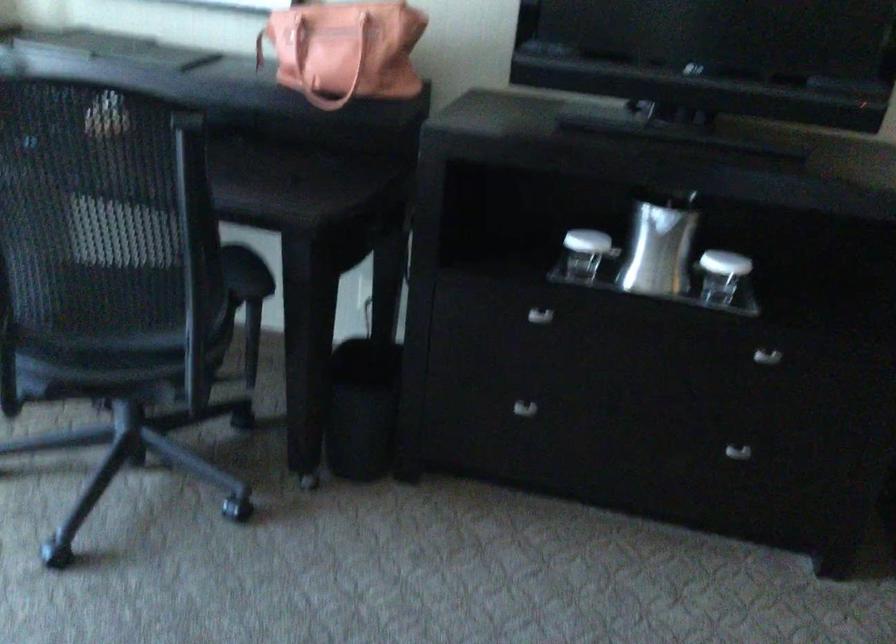
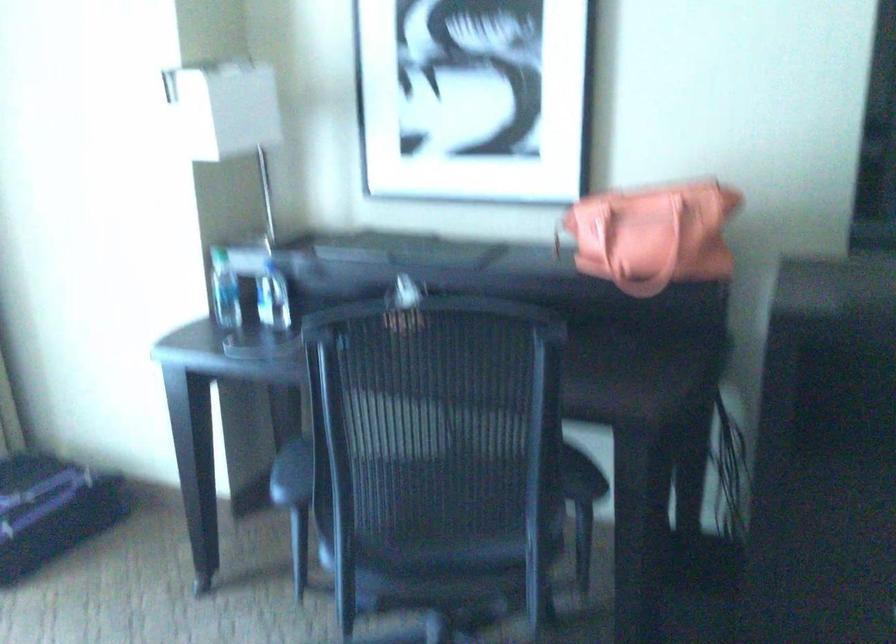
Question: What movement of the cameraman would produce the second image?

Choices:
 (A) Left
 (B) Right
 (C) Forward
 (D) Backward

Answer: (A)